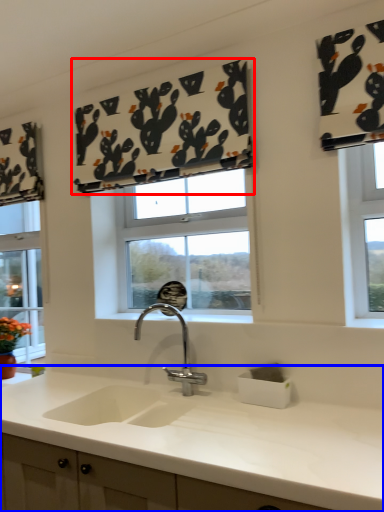
Question: Which object is closer to the camera taking this photo, curtain (highlighted by a red box) or countertop (highlighted by a blue box)?

Choices:
 (A) curtain
 (B) countertop

Answer: (B)